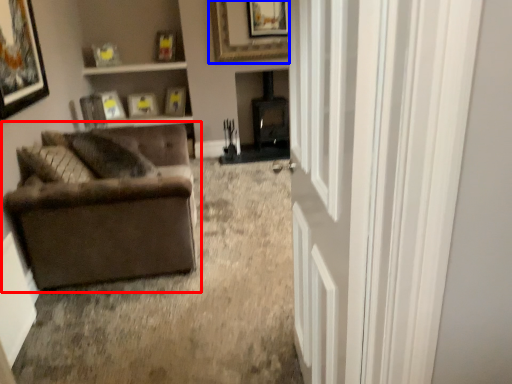
Question: Which object is closer to the camera taking this photo, studio couch (highlighted by a red box) or picture frame (highlighted by a blue box)?

Choices:
 (A) studio couch
 (B) picture frame

Answer: (A)